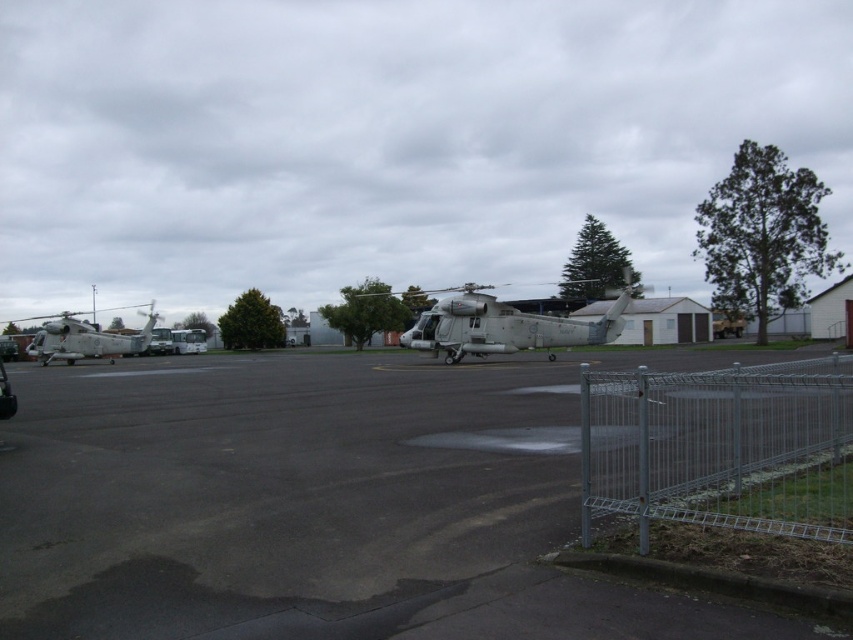
Is dark gray asphalt at center smaller than metallic gray helicopter at left?

Yes, dark gray asphalt at center is smaller than metallic gray helicopter at left.

Is point (3, 552) in front of point (108, 337)?

Yes, it is.

Does point (273, 541) lie in front of point (132, 339)?

Yes, it is in front of point (132, 339).

I want to click on dark gray asphalt at center, so click(x=317, y=502).

Is silver wire mesh fence at lower right smaller than metallic gray helicopter at left?

Yes, silver wire mesh fence at lower right is smaller than metallic gray helicopter at left.

Does silver wire mesh fence at lower right have a greater height compared to metallic gray helicopter at left?

No.

Who is more distant from viewer, [637,486] or [73,330]?

Point [73,330]

You are a GUI agent. You are given a task and a screenshot of the screen. Output one action in this format:
    pyautogui.click(x=<x>, y=<y>)
    Task: Click on the silver wire mesh fence at lower right
    
    Given the screenshot: What is the action you would take?
    pyautogui.click(x=721, y=448)

Can you confirm if gray metallic helicopter at center is thinner than metallic gray helicopter at left?

Yes, gray metallic helicopter at center is thinner than metallic gray helicopter at left.

Where is `gray metallic helicopter at center`? gray metallic helicopter at center is located at coordinates (506, 326).

Is point (524, 326) farther from viewer compared to point (109, 358)?

That is False.

The image size is (853, 640). Identify the location of gray metallic helicopter at center. (506, 326).